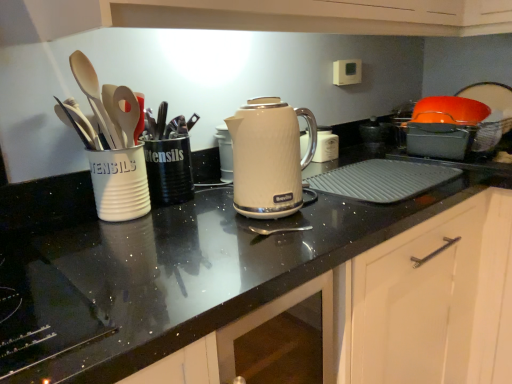
Question: Is matte white kettle at center far away from white matte utensils cup at left, which ranks as the first tableware in left-to-right order?

Choices:
 (A) no
 (B) yes

Answer: (A)

Question: From the image's perspective, does matte white kettle at center appear lower than white matte utensils cup at left, which ranks as the second tableware in right-to-left order?

Choices:
 (A) no
 (B) yes

Answer: (A)

Question: Is matte white kettle at center next to white matte utensils cup at left, which ranks as the first tableware in left-to-right order, and touching it?

Choices:
 (A) yes
 (B) no

Answer: (B)

Question: From a real-world perspective, is matte white kettle at center on top of white matte utensils cup at left, which ranks as the first tableware in left-to-right order?

Choices:
 (A) yes
 (B) no

Answer: (A)

Question: Is matte white kettle at center further to camera compared to white matte utensils cup at left, which ranks as the second tableware in right-to-left order?

Choices:
 (A) no
 (B) yes

Answer: (A)

Question: Does matte white kettle at center have a lesser height compared to white matte utensils cup at left, which ranks as the first tableware in left-to-right order?

Choices:
 (A) no
 (B) yes

Answer: (A)

Question: Considering the relative sizes of white matte utensils cup at left, which ranks as the first tableware in left-to-right order, and white glossy cabinet at center, arranged as the 2th cabinetry when viewed from the right, in the image provided, is white matte utensils cup at left, which ranks as the first tableware in left-to-right order, wider than white glossy cabinet at center, arranged as the 2th cabinetry when viewed from the right,?

Choices:
 (A) no
 (B) yes

Answer: (A)

Question: Is white matte utensils cup at left, which ranks as the second tableware in right-to-left order, not near white glossy cabinet at center, arranged as the 2th cabinetry when viewed from the back?

Choices:
 (A) no
 (B) yes

Answer: (A)

Question: From the image's perspective, does white matte utensils cup at left, which ranks as the second tableware in right-to-left order, appear lower than white glossy cabinet at center, which ranks as the 1th cabinetry in front-to-back order?

Choices:
 (A) yes
 (B) no

Answer: (B)

Question: From the image's perspective, is white matte utensils cup at left, which ranks as the first tableware in left-to-right order, on top of white glossy cabinet at center, which ranks as the 1th cabinetry in front-to-back order?

Choices:
 (A) no
 (B) yes

Answer: (B)

Question: Is white glossy cabinet at center, arranged as the 2th cabinetry when viewed from the back, a part of white matte utensils cup at left, which ranks as the second tableware in right-to-left order?

Choices:
 (A) no
 (B) yes

Answer: (A)

Question: Can you confirm if white matte utensils cup at left, which ranks as the second tableware in right-to-left order, is thinner than white glossy cabinet at center, which ranks as the 1th cabinetry in front-to-back order?

Choices:
 (A) no
 (B) yes

Answer: (B)

Question: Considering the relative sizes of white matte cabinet door at lower right, the 2th cabinetry when ordered from left to right, and matte white kettle at center in the image provided, is white matte cabinet door at lower right, the 2th cabinetry when ordered from left to right, wider than matte white kettle at center?

Choices:
 (A) no
 (B) yes

Answer: (B)